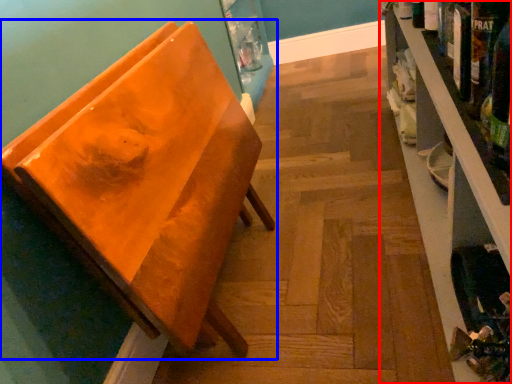
Question: Which object appears closest to the camera in this image, shelf (highlighted by a red box) or furniture (highlighted by a blue box)?

Choices:
 (A) shelf
 (B) furniture

Answer: (A)